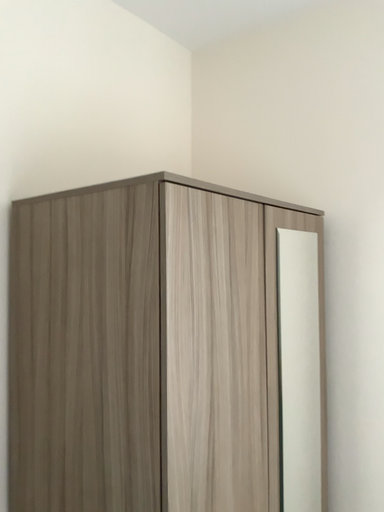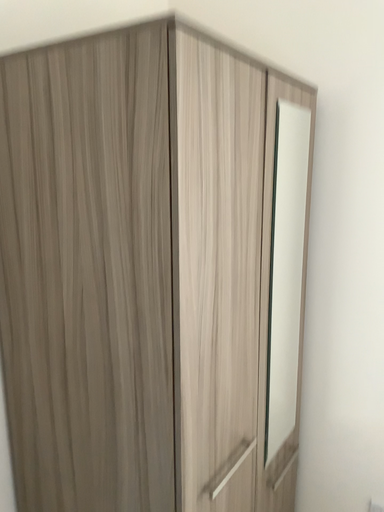
Question: Which way did the camera rotate in the video?

Choices:
 (A) rotated upward
 (B) rotated downward

Answer: (B)